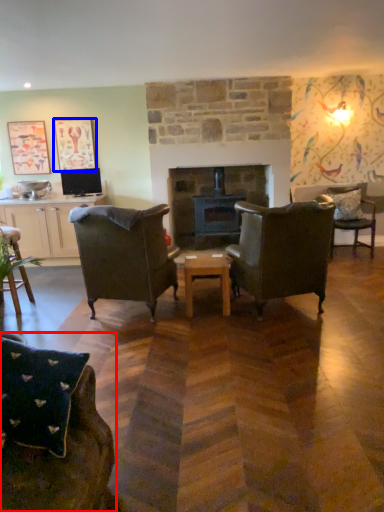
Question: Which object appears farthest to the camera in this image, chair (highlighted by a red box) or picture frame (highlighted by a blue box)?

Choices:
 (A) chair
 (B) picture frame

Answer: (B)